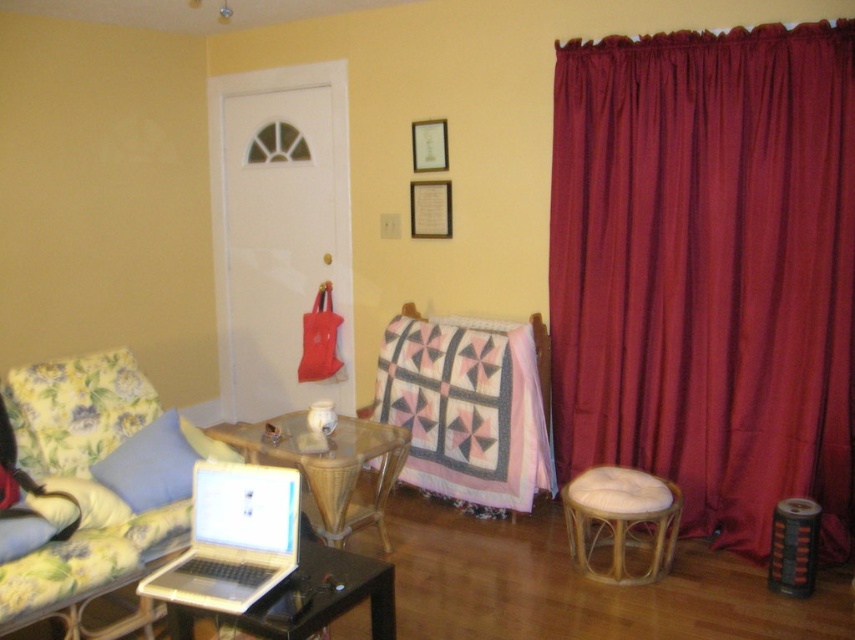
From the picture: You are moving a small plant that is 30 cm wide. You want to place it on the transparent glass table at center or the fluffy yellow pillow at lower left. Which surface can fit the plant?

The transparent glass table at center is wider than the fluffy yellow pillow at lower left, so the plant can fit on the transparent glass table at center.

You are planning to hang a new picture frame on the wall between the burgundy fabric curtain at right and the blue fabric pillow at left. Since the picture frame needs to be at eye level, which object should you consider the height of to ensure the frame is placed correctly?

The burgundy fabric curtain at right is much taller than the blue fabric pillow at left, so you should consider the height of the blue fabric pillow at left to place the picture frame at eye level.